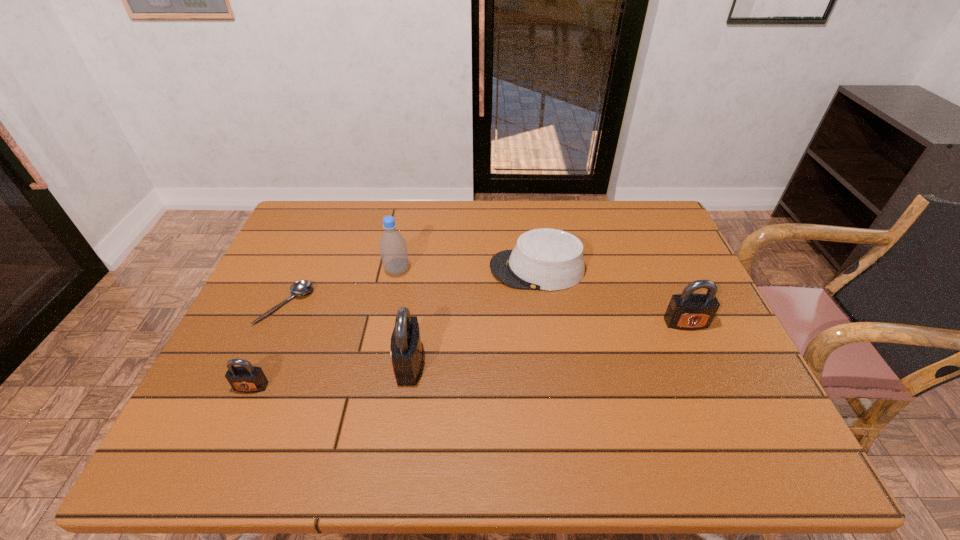
Find the location of `free area in between the second tallest padlock and the bottle`. free area in between the second tallest padlock and the bottle is located at coordinates (541, 296).

Where is `free area in between the farthest padlock and the bottle`? free area in between the farthest padlock and the bottle is located at coordinates (541, 296).

In order to click on vacant area that lies between the bottle and the shortest padlock in this screenshot , I will do tap(324, 328).

You are a GUI agent. You are given a task and a screenshot of the screen. Output one action in this format:
    pyautogui.click(x=<x>, y=<y>)
    Task: Click on the vacant space that is in between the rightmost padlock and the leftmost padlock
    Image resolution: width=960 pixels, height=540 pixels.
    Given the screenshot: What is the action you would take?
    pyautogui.click(x=468, y=355)

Locate an element on the screen. The height and width of the screenshot is (540, 960). free point between the ladle and the third tallest object is located at coordinates (486, 314).

Locate which object is the closest to the bottle. Please provide its 2D coordinates. Your answer should be formatted as a tuple, i.e. [(x, y)], where the tuple contains the x and y coordinates of a point satisfying the conditions above.

[(299, 288)]

Identify which object is the fifth closest to the hat. Please provide its 2D coordinates. Your answer should be formatted as a tuple, i.e. [(x, y)], where the tuple contains the x and y coordinates of a point satisfying the conditions above.

[(246, 378)]

Point out which padlock is positioned as the second nearest to the third object from right to left. Please provide its 2D coordinates. Your answer should be formatted as a tuple, i.e. [(x, y)], where the tuple contains the x and y coordinates of a point satisfying the conditions above.

[(689, 311)]

Locate which padlock is the closest to the second shortest padlock. Please provide its 2D coordinates. Your answer should be formatted as a tuple, i.e. [(x, y)], where the tuple contains the x and y coordinates of a point satisfying the conditions above.

[(406, 349)]

I want to click on vacant space that satisfies the following two spatial constraints: 1. on the front-facing side of the hat; 2. on the front side of the shortest object, so click(x=542, y=305).